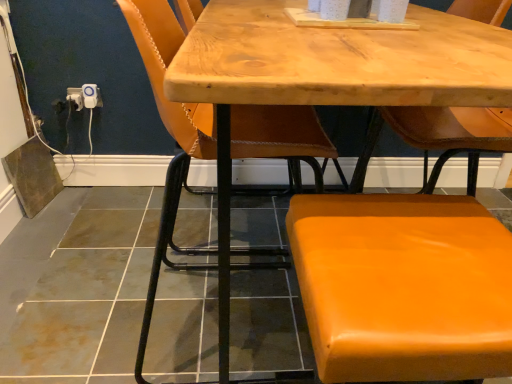
Question: Relative to wooden table at center, is orange leather chair at center, placed as the second chair when sorted from right to left, in front or behind?

Choices:
 (A) behind
 (B) front

Answer: (A)

Question: Is orange leather chair at center, the 1th chair from the left, taller or shorter than wooden table at center?

Choices:
 (A) short
 (B) tall

Answer: (B)

Question: Estimate the real-world distances between objects in this image. Which object is farther from the wooden table at center?

Choices:
 (A) orange leather stool at lower right, acting as the first chair starting from the right
 (B) white plastic electrical outlet at lower left, which is counted as the 1th electric outlet, starting from the left
 (C) white plastic outlet at lower left, arranged as the second electric outlet when viewed from the left
 (D) orange leather chair at center, the 1th chair from the left

Answer: (B)

Question: Estimate the real-world distances between objects in this image. Which object is farther from the white plastic outlet at lower left, arranged as the 1th electric outlet when viewed from the right?

Choices:
 (A) wooden table at center
 (B) white plastic electrical outlet at lower left, arranged as the second electric outlet when viewed from the right
 (C) orange leather stool at lower right, which ranks as the 2th chair in left-to-right order
 (D) orange leather chair at center, placed as the second chair when sorted from right to left

Answer: (C)